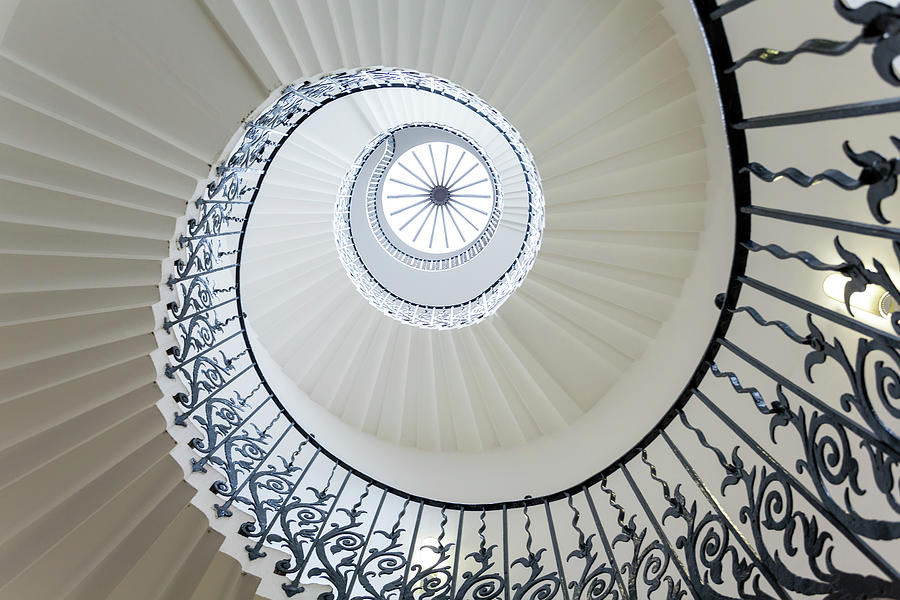
The image size is (900, 600). Find the location of `yellow lights`. yellow lights is located at coordinates (871, 299), (429, 556).